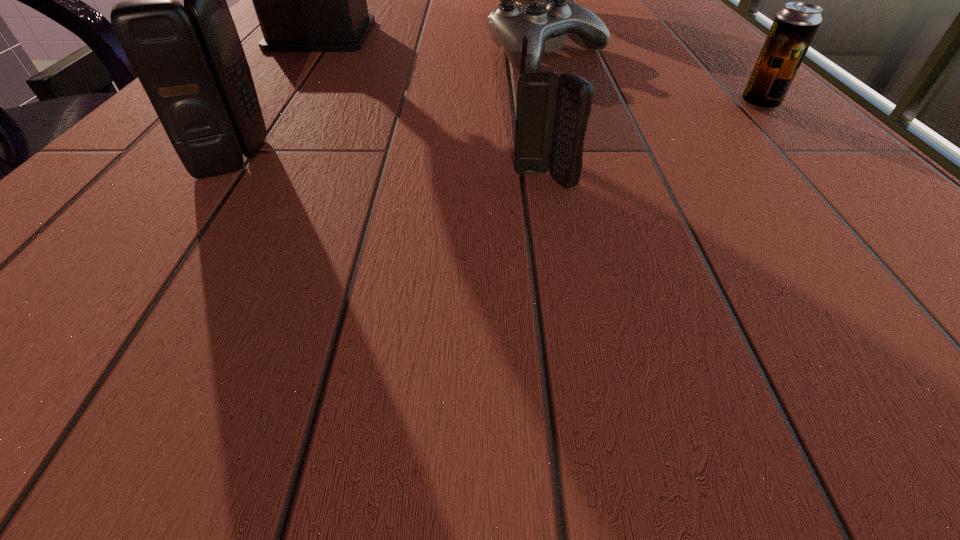
This screenshot has width=960, height=540. In order to click on free location located 0.310m on the front-facing side of the tallest object in this screenshot , I will do point(539,35).

This screenshot has height=540, width=960. In order to click on vacant region located on the left of the second shortest object in this screenshot , I will do `click(531, 104)`.

This screenshot has width=960, height=540. In order to click on cellular telephone at the left edge in this screenshot , I will do `click(189, 59)`.

Identify the location of award that is at the left edge. The image size is (960, 540). (307, 0).

The height and width of the screenshot is (540, 960). In order to click on object that is at the right edge in this screenshot , I will do (x=794, y=27).

This screenshot has height=540, width=960. Identify the location of vacant space at the left edge. (146, 134).

This screenshot has height=540, width=960. What are the coordinates of `vacant space at the right edge of the desktop` in the screenshot? It's located at (814, 166).

Locate an element on the screen. This screenshot has height=540, width=960. free space at the near right corner of the desktop is located at coordinates (934, 259).

You are a GUI agent. You are given a task and a screenshot of the screen. Output one action in this format:
    pyautogui.click(x=<x>, y=<y>)
    Task: Click on the vacant point located between the award and the shorter cellular telephone
    The width and height of the screenshot is (960, 540).
    Given the screenshot: What is the action you would take?
    pyautogui.click(x=433, y=107)

The image size is (960, 540). I want to click on free space between the taller cellular telephone and the control, so click(x=392, y=107).